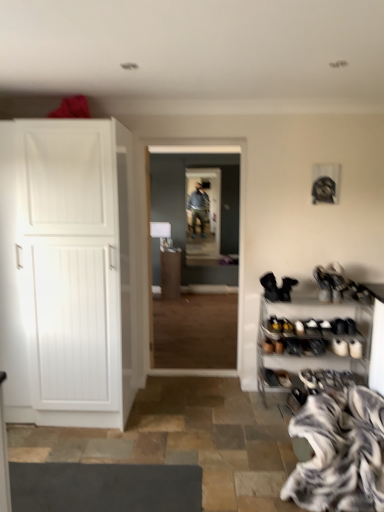
Describe the element at coordinates (270, 287) in the screenshot. I see `black suede boot at lower right, the 1th footwear from the left` at that location.

Locate an element on the screen. The image size is (384, 512). metallic silver shoe rack at lower right is located at coordinates (312, 340).

What is the approximate height of metallic silver shoe rack at lower right?

The height of metallic silver shoe rack at lower right is 32.75 inches.

Describe the element at coordinates (340, 453) in the screenshot. Image resolution: width=384 pixels, height=512 pixels. I see `zebra print fur at lower right` at that location.

The height and width of the screenshot is (512, 384). In order to click on matte white cabinet at center in this screenshot , I will do `click(170, 273)`.

Where is `black suede boot at right, the 1th footwear from the right`? black suede boot at right, the 1th footwear from the right is located at coordinates (287, 288).

Does white matte cabinet at left come in front of metallic silver shoe rack at lower right?

Yes, it is.

Does point (130, 396) lie behind point (363, 333)?

Yes, point (130, 396) is behind point (363, 333).

At what (x,y) coordinates should I click in order to perform the action: click on cupboard on the left of the metallic silver shoe rack at lower right. Please return your answer as a coordinate pair (x, y). Looking at the image, I should click on (78, 271).

Between black suede boot at right, the 1th footwear from the right, and matte gray screen door at center, which one appears on the right side from the viewer's perspective?

black suede boot at right, the 1th footwear from the right, is more to the right.

Is black suede boot at right, the 1th footwear from the right, far away from matte gray screen door at center?

Indeed, black suede boot at right, the 1th footwear from the right, is not near matte gray screen door at center.

Which is farther from the camera, (x=297, y=281) or (x=189, y=197)?

The point (x=189, y=197) is farther from the camera.

Considering the relative positions of black suede boot at right, the second footwear in the left-to-right sequence, and white matte cabinet at left in the image provided, is black suede boot at right, the second footwear in the left-to-right sequence, to the left of white matte cabinet at left from the viewer's perspective?

In fact, black suede boot at right, the second footwear in the left-to-right sequence, is to the right of white matte cabinet at left.

Choose the correct answer: Is black suede boot at right, the 1th footwear from the right, inside white matte cabinet at left or outside it?

black suede boot at right, the 1th footwear from the right, lies outside white matte cabinet at left.

The image size is (384, 512). Find the location of `cupboard positioned vertically above the black suede boot at right, the 1th footwear from the right (from a real-world perspective)`. cupboard positioned vertically above the black suede boot at right, the 1th footwear from the right (from a real-world perspective) is located at coordinates (78, 271).

Is matte gray screen door at center to the right of zebra print fur at lower right from the viewer's perspective?

No.

How many degrees apart are the facing directions of matte gray screen door at center and zebra print fur at lower right?

They differ by 90.2 degrees in their facing directions.

Is point (208, 185) closer or farther from the camera than point (329, 455)?

Point (208, 185) is positioned farther from the camera compared to point (329, 455).

Considering the sizes of objects matte gray screen door at center and zebra print fur at lower right in the image provided, who is thinner, matte gray screen door at center or zebra print fur at lower right?

With smaller width is matte gray screen door at center.

Consider the image. How many degrees apart are the facing directions of white matte cabinet at left and black suede boot at lower right, acting as the 2th footwear starting from the right?

The facing directions of white matte cabinet at left and black suede boot at lower right, acting as the 2th footwear starting from the right, are 0.616 degrees apart.

Is black suede boot at lower right, acting as the 2th footwear starting from the right, a part of white matte cabinet at left?

No, black suede boot at lower right, acting as the 2th footwear starting from the right, is not inside white matte cabinet at left.

From a real-world perspective, which is physically above, white matte cabinet at left or black suede boot at lower right, the 1th footwear from the left?

From a 3D spatial view, white matte cabinet at left is above.

Does point (93, 376) lie behind point (273, 286)?

No, it is not.

What's the angular difference between matte white cabinet at center and metallic silver shoe rack at lower right's facing directions?

0.119 degrees separate the facing orientations of matte white cabinet at center and metallic silver shoe rack at lower right.

From a real-world perspective, is matte white cabinet at center located beneath metallic silver shoe rack at lower right?

Indeed, from a real-world perspective, matte white cabinet at center is positioned beneath metallic silver shoe rack at lower right.

Is matte white cabinet at center far away from metallic silver shoe rack at lower right?

Yes, matte white cabinet at center and metallic silver shoe rack at lower right are quite far apart.

Is black suede boot at lower right, the 1th footwear from the left, to the left or to the right of matte white cabinet at center in the image?

Based on their positions, black suede boot at lower right, the 1th footwear from the left, is located to the right of matte white cabinet at center.

Between black suede boot at lower right, the 1th footwear from the left, and matte white cabinet at center, which one is positioned in front?

Positioned in front is black suede boot at lower right, the 1th footwear from the left.

Based on the photo, would you say black suede boot at lower right, the 1th footwear from the left, is outside matte white cabinet at center?

black suede boot at lower right, the 1th footwear from the left, lies outside matte white cabinet at center's area.

There is a metallic silver shoe rack at lower right. Find the location of `cupboard above it (from a real-world perspective)`. cupboard above it (from a real-world perspective) is located at coordinates (78, 271).

Identify the location of screen door behind the black suede boot at right, the second footwear in the left-to-right sequence. The height and width of the screenshot is (512, 384). [x=204, y=216].

Which object lies nearer to the anchor point black suede boot at right, the 1th footwear from the right, zebra print fur at lower right or wooden floor at center?

Among the two, zebra print fur at lower right is located nearer to black suede boot at right, the 1th footwear from the right.

Which object lies nearer to the anchor point metallic silver shoe rack at lower right, matte white cabinet at center or wooden floor at center?

Based on the image, matte white cabinet at center appears to be nearer to metallic silver shoe rack at lower right.

When comparing their distances from white matte cabinet at left, does black suede boot at lower right, acting as the 2th footwear starting from the right, or matte gray screen door at center seem further?

Among the two, matte gray screen door at center is located further to white matte cabinet at left.

Looking at the image, which one is located closer to zebra print fur at lower right, wooden floor at center or matte gray screen door at center?

The object closer to zebra print fur at lower right is wooden floor at center.

Considering their positions, is white matte cabinet at left positioned further to matte gray screen door at center than zebra print fur at lower right?

zebra print fur at lower right is further to matte gray screen door at center.

Based on the photo, estimate the real-world distances between objects in this image. Which object is further from black suede boot at right, the second footwear in the left-to-right sequence, matte white cabinet at center or zebra print fur at lower right?

matte white cabinet at center is further to black suede boot at right, the second footwear in the left-to-right sequence.

Looking at the image, which one is located closer to white matte cabinet at left, zebra print fur at lower right or matte white cabinet at center?

Based on the image, zebra print fur at lower right appears to be nearer to white matte cabinet at left.

Looking at the image, which one is located closer to black suede boot at lower right, acting as the 2th footwear starting from the right, white matte cabinet at left or metallic silver shoe rack at lower right?

Based on the image, metallic silver shoe rack at lower right appears to be nearer to black suede boot at lower right, acting as the 2th footwear starting from the right.

Where is `footwear between zebra print fur at lower right and black suede boot at right, the second footwear in the left-to-right sequence, along the z-axis`? footwear between zebra print fur at lower right and black suede boot at right, the second footwear in the left-to-right sequence, along the z-axis is located at coordinates (270, 287).

Identify the location of shelf between zebra print fur at lower right and black suede boot at right, the 1th footwear from the right, from front to back. The height and width of the screenshot is (512, 384). (312, 340).

Locate an element on the screen. cabinetry between black suede boot at lower right, acting as the 2th footwear starting from the right, and matte gray screen door at center, along the z-axis is located at coordinates (170, 273).

This screenshot has width=384, height=512. I want to click on corridor positioned between black suede boot at lower right, the 1th footwear from the left, and matte gray screen door at center from near to far, so click(204, 222).